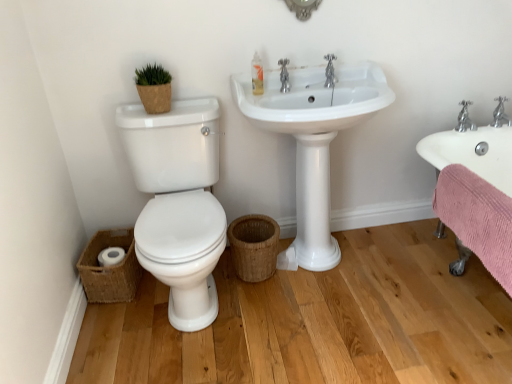
At what (x,y) coordinates should I click in order to perform the action: click on free space in front of woven brown basket at lower center, which appears as the 2th basket when viewed from the left. Please return your answer as a coordinate pair (x, y). Looking at the image, I should click on (261, 313).